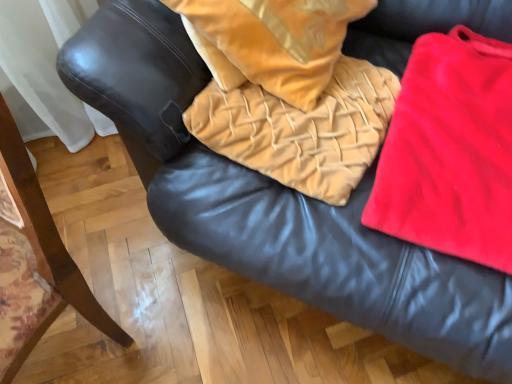
Question: Does matte black armrest at left turn towards red velvet cloth at right?

Choices:
 (A) yes
 (B) no

Answer: (B)

Question: Is matte black armrest at left positioned before red velvet cloth at right?

Choices:
 (A) yes
 (B) no

Answer: (A)

Question: Considering the relative sizes of matte black armrest at left and red velvet cloth at right in the image provided, is matte black armrest at left bigger than red velvet cloth at right?

Choices:
 (A) no
 (B) yes

Answer: (B)

Question: Are matte black armrest at left and red velvet cloth at right far apart?

Choices:
 (A) yes
 (B) no

Answer: (B)

Question: Can you confirm if matte black armrest at left is smaller than red velvet cloth at right?

Choices:
 (A) yes
 (B) no

Answer: (B)

Question: Would you say matte black armrest at left is outside red velvet cloth at right?

Choices:
 (A) yes
 (B) no

Answer: (A)

Question: Does velvet tan pillow at center have a greater height compared to matte black armrest at left?

Choices:
 (A) yes
 (B) no

Answer: (B)

Question: From a real-world perspective, is velvet tan pillow at center physically below matte black armrest at left?

Choices:
 (A) yes
 (B) no

Answer: (B)

Question: Considering the relative sizes of velvet tan pillow at center and matte black armrest at left in the image provided, is velvet tan pillow at center bigger than matte black armrest at left?

Choices:
 (A) yes
 (B) no

Answer: (B)

Question: Is velvet tan pillow at center surrounding matte black armrest at left?

Choices:
 (A) no
 (B) yes

Answer: (A)

Question: Is velvet tan pillow at center aimed at matte black armrest at left?

Choices:
 (A) yes
 (B) no

Answer: (B)

Question: Does velvet tan pillow at center have a lesser width compared to matte black armrest at left?

Choices:
 (A) yes
 (B) no

Answer: (A)

Question: Can you confirm if matte black armrest at left is thinner than velvet tan blanket at center?

Choices:
 (A) yes
 (B) no

Answer: (A)